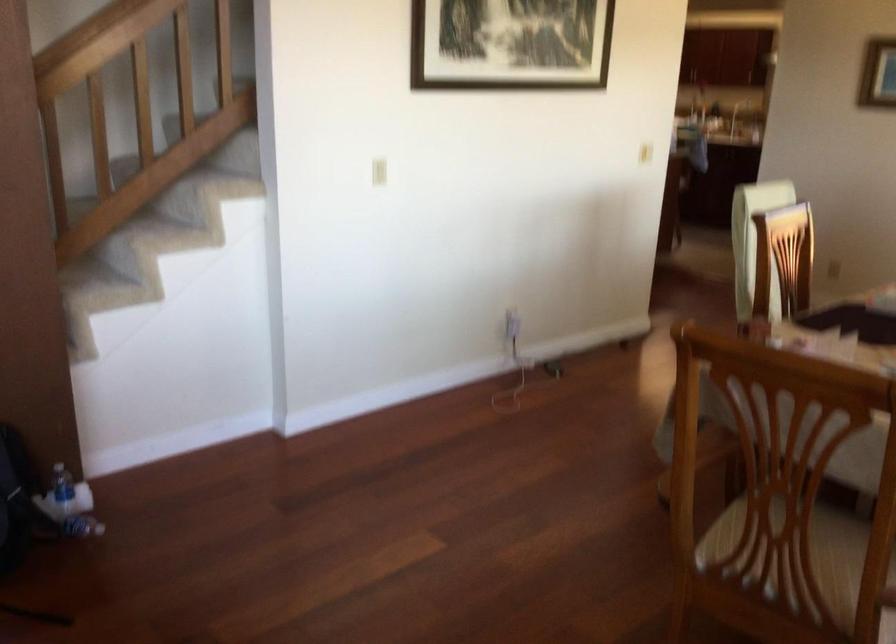
Image resolution: width=896 pixels, height=644 pixels. What are the coordinates of `chair sitting surface` in the screenshot? It's located at (736, 532).